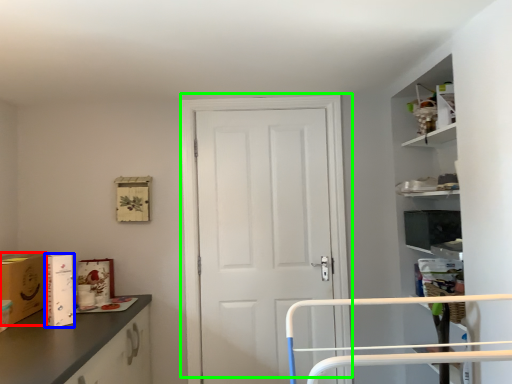
Question: Which is farther away from cardboard box (highlighted by a red box)? cardboard box (highlighted by a blue box) or door (highlighted by a green box)?

Choices:
 (A) cardboard box
 (B) door

Answer: (B)